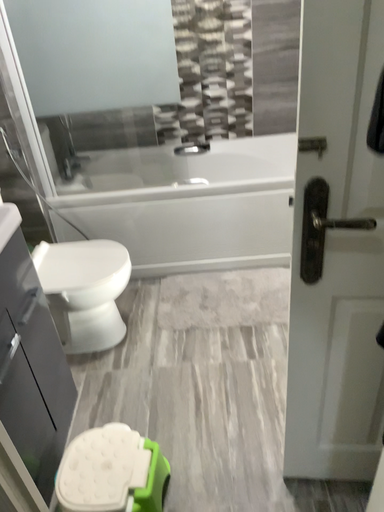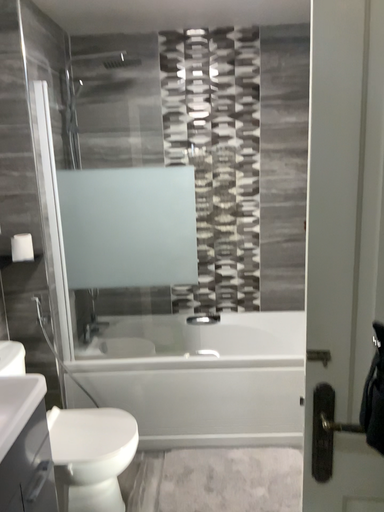
Question: How did the camera likely rotate when shooting the video?

Choices:
 (A) rotated upward
 (B) rotated downward

Answer: (A)